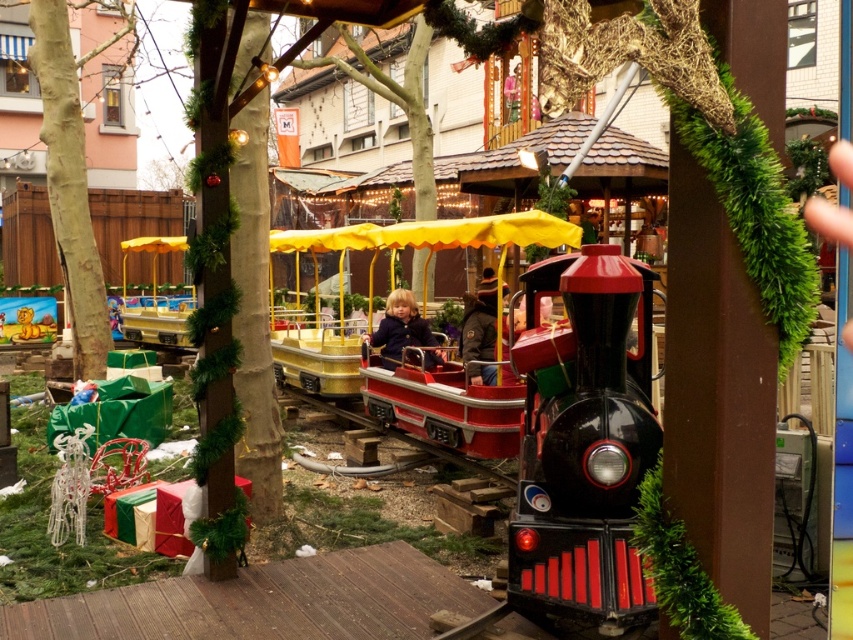
Question: Is green rough bark tree at left further to the viewer compared to dark brown leather jacket at center?

Choices:
 (A) no
 (B) yes

Answer: (B)

Question: Which point is closer to the camera taking this photo?

Choices:
 (A) (71, 84)
 (B) (398, 316)
 (C) (468, 374)
 (D) (564, 372)

Answer: (D)

Question: Based on their relative distances, which object is farther from the green rough bark tree at left?

Choices:
 (A) dark blue jacket at center
 (B) shiny red plastic train at center

Answer: (B)

Question: Which point is closer to the camera?

Choices:
 (A) dark blue jacket at center
 (B) shiny red plastic train at center

Answer: (B)

Question: Is dark brown leather jacket at center to the right of dark blue jacket at center from the viewer's perspective?

Choices:
 (A) no
 (B) yes

Answer: (B)

Question: Does green rough bark tree at left have a greater width compared to dark brown leather jacket at center?

Choices:
 (A) no
 (B) yes

Answer: (A)